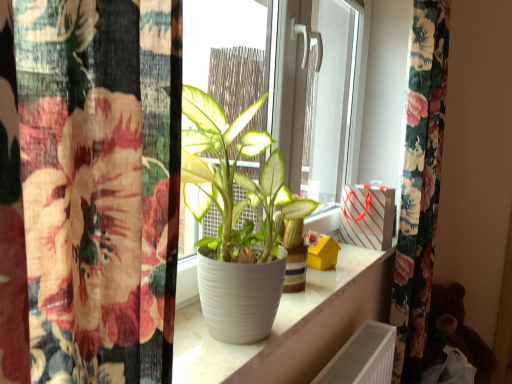
In order to face white matte pot at center, should I rotate leftwards or rightwards?

Turn left approximately 4.116 degrees to face it.

Describe the element at coordinates (455, 332) in the screenshot. I see `brown plush bear at lower right` at that location.

Measure the distance between white striped paper bag at upper right and camera.

The depth of white striped paper bag at upper right is 5.12 feet.

Describe the element at coordinates (292, 326) in the screenshot. I see `white glossy pot at center` at that location.

The height and width of the screenshot is (384, 512). I want to click on white matte pot at center, so click(236, 220).

Is white striped paper bag at upper right facing away from white glossy pot at center?

No, white striped paper bag at upper right is not facing the opposite direction of white glossy pot at center.

Which point is more distant from viewer, (342, 238) or (323, 298)?

Positioned behind is point (342, 238).

Would you say white striped paper bag at upper right contains white glossy pot at center?

No, white glossy pot at center is not a part of white striped paper bag at upper right.

Does white striped paper bag at upper right touch white glossy pot at center?

No, white striped paper bag at upper right is not making contact with white glossy pot at center.

Considering the relative positions of white glossy pot at center and white striped paper bag at upper right in the image provided, is white glossy pot at center behind white striped paper bag at upper right?

No.

From a real-world perspective, is white glossy pot at center located higher than white striped paper bag at upper right?

No, from a real-world perspective, white glossy pot at center is not above white striped paper bag at upper right.

From the image's perspective, is white glossy pot at center located above or below white striped paper bag at upper right?

From the image's perspective, white glossy pot at center appears below white striped paper bag at upper right.

Does white glossy pot at center turn towards white striped paper bag at upper right?

No, white glossy pot at center is not oriented towards white striped paper bag at upper right.

How much distance is there between brown plush bear at lower right and white glossy pot at center?

A distance of 1.07 meters exists between brown plush bear at lower right and white glossy pot at center.

Who is shorter, brown plush bear at lower right or white glossy pot at center?

Standing shorter between the two is white glossy pot at center.

Does brown plush bear at lower right have a smaller size compared to white glossy pot at center?

Incorrect, brown plush bear at lower right is not smaller in size than white glossy pot at center.

The image size is (512, 384). Identify the location of window sill above the brown plush bear at lower right (from a real-world perspective). (292, 326).

Between point (454, 291) and point (362, 202), which one is positioned in front?

The point (362, 202) is closer to the camera.

In the scene shown: From the image's perspective, is brown plush bear at lower right positioned above or below white striped paper bag at upper right?

From the image's perspective, brown plush bear at lower right appears below white striped paper bag at upper right.

Is brown plush bear at lower right looking in the opposite direction of white striped paper bag at upper right?

No, brown plush bear at lower right is not facing the opposite direction of white striped paper bag at upper right.

Considering the relative positions of brown plush bear at lower right and white striped paper bag at upper right in the image provided, is brown plush bear at lower right in front of white striped paper bag at upper right?

No, brown plush bear at lower right is further to the viewer.

Consider the image. Would you say white matte pot at center is part of brown plush bear at lower right's contents?

Definitely not — white matte pot at center is not inside brown plush bear at lower right.

Which object is wider, brown plush bear at lower right or white matte pot at center?

Wider between the two is brown plush bear at lower right.

Considering the positions of point (436, 338) and point (219, 335), is point (436, 338) closer or farther from the camera than point (219, 335)?

Clearly, point (436, 338) is more distant from the camera than point (219, 335).

From a real-world perspective, between brown plush bear at lower right and white matte pot at center, who is vertically higher?

white matte pot at center is physically above.

Is white glossy pot at center oriented away from white matte pot at center?

No, white glossy pot at center is not facing the opposite direction of white matte pot at center.

Is white glossy pot at center bigger or smaller than white matte pot at center?

In the image, white glossy pot at center appears to be smaller than white matte pot at center.

Considering the sizes of objects white glossy pot at center and white matte pot at center in the image provided, who is shorter, white glossy pot at center or white matte pot at center?

white glossy pot at center.

Is white glossy pot at center not close to white matte pot at center?

That's not correct — white glossy pot at center is a little close to white matte pot at center.

Considering the sizes of white glossy pot at center and brown plush bear at lower right in the image, is white glossy pot at center bigger or smaller than brown plush bear at lower right?

In the image, white glossy pot at center appears to be smaller than brown plush bear at lower right.

How different are the orientations of white glossy pot at center and brown plush bear at lower right in degrees?

0.132 degrees.

Considering the relative positions of white glossy pot at center and brown plush bear at lower right in the image provided, is white glossy pot at center to the left or to the right of brown plush bear at lower right?

white glossy pot at center is to the left of brown plush bear at lower right.

From a real-world perspective, is white glossy pot at center under brown plush bear at lower right?

Incorrect, from a real-world perspective, white glossy pot at center is higher than brown plush bear at lower right.

This screenshot has height=384, width=512. I want to click on window sill below the white striped paper bag at upper right (from a real-world perspective), so click(292, 326).

Find the location of a particular element. This screenshot has height=384, width=512. window box behind the white glossy pot at center is located at coordinates (367, 216).

From the image, which object appears to be farther from white striped paper bag at upper right, white matte pot at center or brown plush bear at lower right?

Based on the image, brown plush bear at lower right appears to be further to white striped paper bag at upper right.

Which object lies further to the anchor point white striped paper bag at upper right, white matte pot at center or white glossy pot at center?

white matte pot at center.

In the scene shown: Looking at the image, which one is located further to brown plush bear at lower right, white glossy pot at center or white matte pot at center?

The object further to brown plush bear at lower right is white matte pot at center.

Estimate the real-world distances between objects in this image. Which object is further from white glossy pot at center, white striped paper bag at upper right or brown plush bear at lower right?

The object further to white glossy pot at center is brown plush bear at lower right.

Based on the photo, considering their positions, is white striped paper bag at upper right positioned closer to brown plush bear at lower right than white matte pot at center?

white striped paper bag at upper right lies closer to brown plush bear at lower right than the other object.

Estimate the real-world distances between objects in this image. Which object is closer to brown plush bear at lower right, white matte pot at center or white striped paper bag at upper right?

The object closer to brown plush bear at lower right is white striped paper bag at upper right.

From the image, which object appears to be nearer to brown plush bear at lower right, white glossy pot at center or white striped paper bag at upper right?

The object closer to brown plush bear at lower right is white striped paper bag at upper right.

Estimate the real-world distances between objects in this image. Which object is closer to white matte pot at center, brown plush bear at lower right or white striped paper bag at upper right?

Among the two, white striped paper bag at upper right is located nearer to white matte pot at center.

Where is `window sill positioned between white matte pot at center and brown plush bear at lower right from near to far`? The image size is (512, 384). window sill positioned between white matte pot at center and brown plush bear at lower right from near to far is located at coordinates (292, 326).

Find the location of a particular element. Image resolution: width=512 pixels, height=384 pixels. window box located between white glossy pot at center and brown plush bear at lower right in the depth direction is located at coordinates [x=367, y=216].

Identify the location of window sill between white matte pot at center and white striped paper bag at upper right along the z-axis. The image size is (512, 384). (292, 326).

Where is `window box located between white matte pot at center and brown plush bear at lower right in the depth direction`? window box located between white matte pot at center and brown plush bear at lower right in the depth direction is located at coordinates (367, 216).